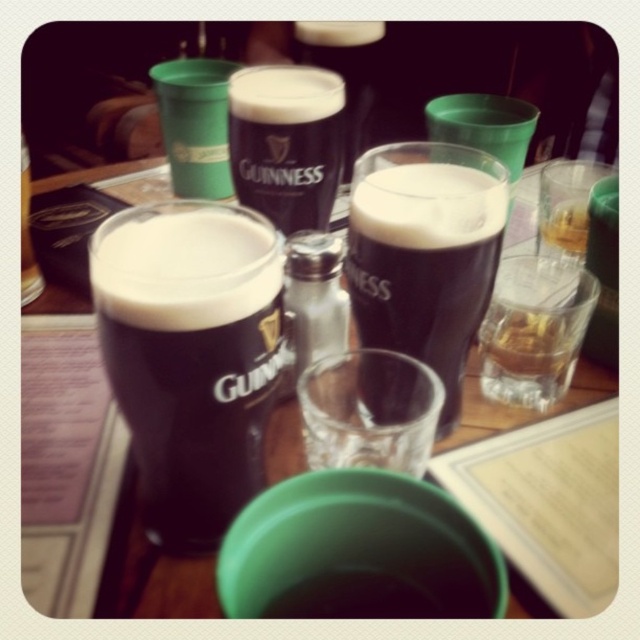
You are a bartender arranging drinks on a table. You have a dark glass stout at center and a guinness stout glass at center. According to the scene, where should you place the dark glass stout relative to the guinness stout glass?

The dark glass stout at center should be placed below the guinness stout glass at center as per the scene description.

Based on the photo, you are a bartender who needs to place a coaster under the dark glass stout at center and the translucent glass at center. Which glass should you place the coaster under first to ensure both are stable?

The dark glass stout at center is below the translucent glass at center, so you should place the coaster under the dark glass stout at center first to ensure stability.

Please provide the 2D coordinates of the guinness stout glass at center in the image. The coordinates should be in the format of a point with two decimal places, such as 0.12,0.34.

The guinness stout glass at center is located at point [285,141].